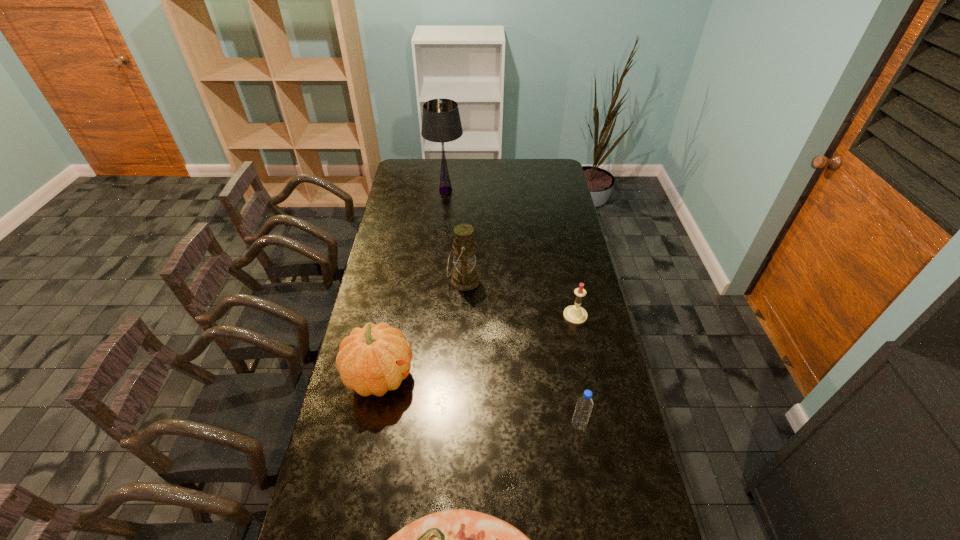
Where is `the farthest object`? The height and width of the screenshot is (540, 960). the farthest object is located at coordinates (441, 122).

Where is `lampshade`? This screenshot has height=540, width=960. lampshade is located at coordinates (441, 122).

Identify the location of oil lamp. (465, 277).

You are a GUI agent. You are given a task and a screenshot of the screen. Output one action in this format:
    pyautogui.click(x=<x>, y=<y>)
    Task: Click on the third nearest object
    
    Given the screenshot: What is the action you would take?
    pyautogui.click(x=374, y=359)

You are a GUI agent. You are given a task and a screenshot of the screen. Output one action in this format:
    pyautogui.click(x=<x>, y=<y>)
    Task: Click on the water bottle
    This screenshot has width=960, height=540.
    Given the screenshot: What is the action you would take?
    click(x=584, y=406)

I want to click on the fourth nearest object, so click(575, 314).

Find the location of a particular element. Image resolution: width=960 pixels, height=540 pixels. vacant space situated 0.250m on the front-facing side of the tallest object is located at coordinates (512, 190).

Where is `vacant area situated 0.190m on the left of the oil lamp`? This screenshot has height=540, width=960. vacant area situated 0.190m on the left of the oil lamp is located at coordinates (402, 281).

I want to click on vacant region located on the carved face of the pumpkin, so click(522, 376).

The height and width of the screenshot is (540, 960). In order to click on free space located 0.050m on the right of the water bottle in this screenshot , I will do `click(603, 425)`.